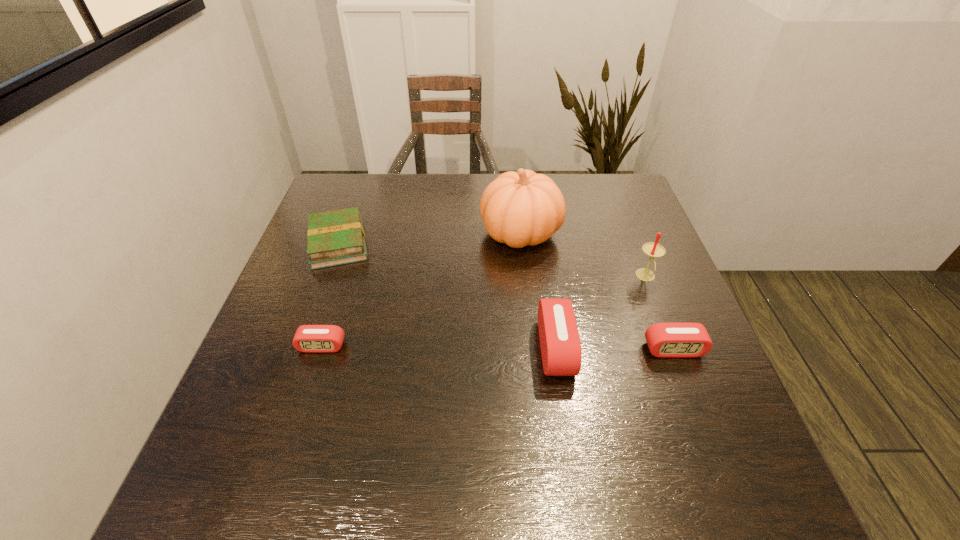
Identify the location of vacant space located on the front-facing side of the rightmost alarm clock. This screenshot has width=960, height=540. (694, 401).

Locate an element on the screen. The image size is (960, 540). vacant space located on the back of the pumpkin is located at coordinates (515, 176).

Image resolution: width=960 pixels, height=540 pixels. Find the location of `vacant position located 0.130m on the left of the fifth shortest object`. vacant position located 0.130m on the left of the fifth shortest object is located at coordinates (583, 277).

This screenshot has width=960, height=540. What are the coordinates of `free location located 0.050m on the front of the book` in the screenshot? It's located at (324, 285).

The image size is (960, 540). I want to click on object at the far edge, so click(521, 208).

The image size is (960, 540). I want to click on alarm clock that is positioned at the left edge, so click(308, 338).

This screenshot has width=960, height=540. I want to click on book that is at the left edge, so click(x=337, y=237).

You are a GUI agent. You are given a task and a screenshot of the screen. Output one action in this format:
    pyautogui.click(x=<x>, y=<y>)
    Task: Click on the alarm clock present at the right edge
    The width and height of the screenshot is (960, 540).
    Given the screenshot: What is the action you would take?
    pyautogui.click(x=671, y=340)

Locate an element on the screen. This screenshot has height=540, width=960. candle located at the right edge is located at coordinates (654, 250).

In the image, there is a desktop. Where is `vacant space at the far edge`? vacant space at the far edge is located at coordinates (411, 182).